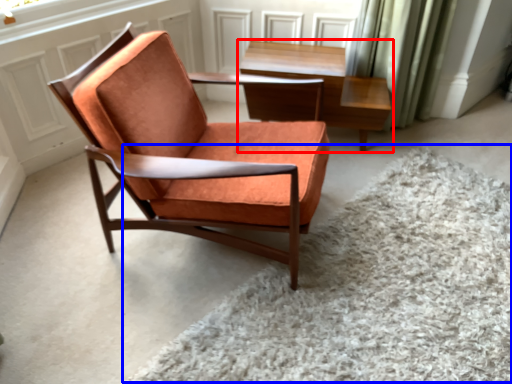
Question: Which object is closer to the camera taking this photo, table (highlighted by a red box) or plain (highlighted by a blue box)?

Choices:
 (A) table
 (B) plain

Answer: (B)